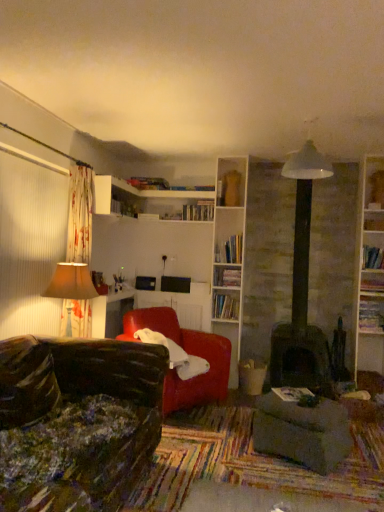
Question: Can you confirm if hardcover book at upper right, which is counted as the 2th book, starting from the right, is thinner than white glossy bookshelf at upper center?

Choices:
 (A) yes
 (B) no

Answer: (A)

Question: Is hardcover book at upper right, which is counted as the 2th book, starting from the right, positioned behind white glossy bookshelf at upper center?

Choices:
 (A) no
 (B) yes

Answer: (B)

Question: Is hardcover book at upper right, which is counted as the 6th book, starting from the top, aimed at white glossy bookshelf at upper center?

Choices:
 (A) yes
 (B) no

Answer: (B)

Question: Is hardcover book at upper right, which is counted as the 2th book, starting from the right, to the right of white glossy bookshelf at upper center from the viewer's perspective?

Choices:
 (A) yes
 (B) no

Answer: (A)

Question: Does hardcover book at upper right, which is counted as the 2th book, starting from the right, have a greater width compared to white glossy bookshelf at upper center?

Choices:
 (A) no
 (B) yes

Answer: (A)

Question: In terms of height, does hardcover book at right, which is the 4th book in bottom-to-top order, look taller or shorter compared to hardcover book at center, the fifth book from the right?

Choices:
 (A) tall
 (B) short

Answer: (A)

Question: From a real-world perspective, relative to hardcover book at center, acting as the first book starting from the bottom, is hardcover book at right, placed as the 3th book when sorted from right to left, vertically above or below?

Choices:
 (A) below
 (B) above

Answer: (B)

Question: Considering the positions of point (380, 275) and point (301, 391), is point (380, 275) closer or farther from the camera than point (301, 391)?

Choices:
 (A) farther
 (B) closer

Answer: (A)

Question: Is hardcover book at right, which is the 4th book in bottom-to-top order, inside or outside of hardcover book at center, which ranks as the 6th book in left-to-right order?

Choices:
 (A) outside
 (B) inside

Answer: (A)

Question: From a real-world perspective, is beige fabric lampshade at left above or below hardcover book at upper center, which appears as the second book when viewed from the left?

Choices:
 (A) below
 (B) above

Answer: (A)

Question: Is beige fabric lampshade at left inside or outside of hardcover book at upper center, which is the 1th book in top-to-bottom order?

Choices:
 (A) inside
 (B) outside

Answer: (B)

Question: Is beige fabric lampshade at left in front of or behind hardcover book at upper center, which appears as the second book when viewed from the left, in the image?

Choices:
 (A) behind
 (B) front

Answer: (B)

Question: Considering the positions of point (56, 275) and point (144, 180), is point (56, 275) closer or farther from the camera than point (144, 180)?

Choices:
 (A) farther
 (B) closer

Answer: (B)

Question: Is point (203, 203) closer or farther from the camera than point (231, 234)?

Choices:
 (A) closer
 (B) farther

Answer: (B)

Question: Based on their sizes in the image, would you say hardcover books at center, the 8th book positioned from the bottom, is bigger or smaller than hardcover book at center, which is the 6th book from bottom to top?

Choices:
 (A) small
 (B) big

Answer: (A)